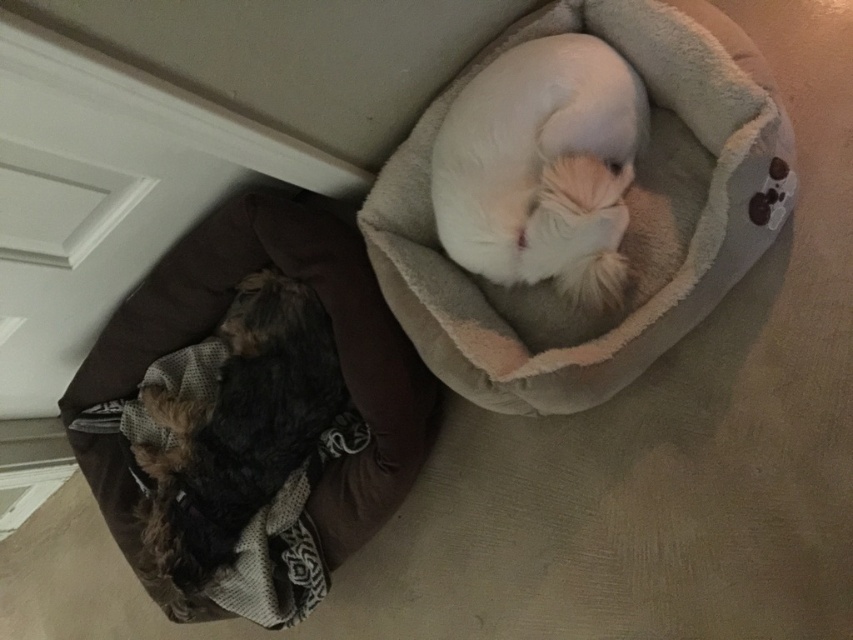
Question: Which object is farther from the camera taking this photo?

Choices:
 (A) white fluffy cat at upper center
 (B) fuzzy brown dog at lower left

Answer: (B)

Question: Which point is farther to the camera?

Choices:
 (A) (86, 481)
 (B) (654, 20)
 (C) (318, 406)

Answer: (A)

Question: Can you confirm if white fluffy cat at upper center is wider than fuzzy brown dog at lower left?

Choices:
 (A) no
 (B) yes

Answer: (A)

Question: Does beige plush cat bed at center have a larger size compared to white fluffy cat at upper center?

Choices:
 (A) yes
 (B) no

Answer: (A)

Question: Which point appears farthest from the camera in this image?

Choices:
 (A) coord(573,237)
 (B) coord(689,80)
 (C) coord(151,577)
 (D) coord(315,212)

Answer: (C)

Question: Is beige plush cat bed at center thinner than white fluffy cat at upper center?

Choices:
 (A) no
 (B) yes

Answer: (A)